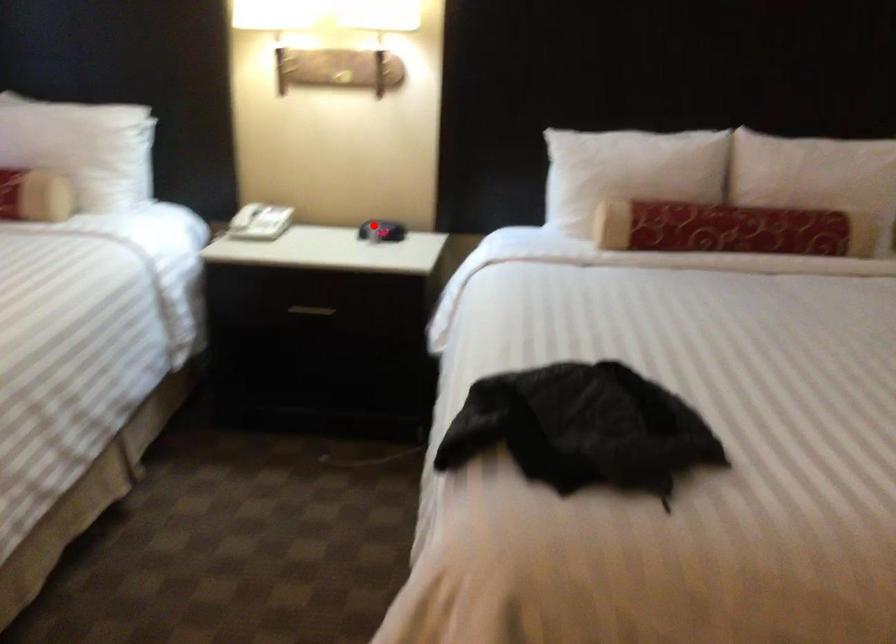
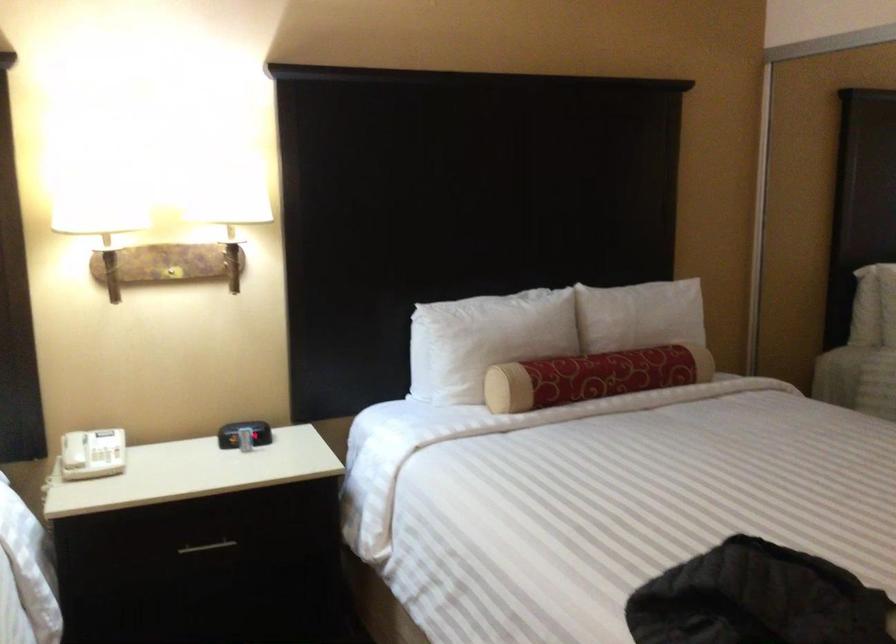
Question: I am providing you with two images of the same scene from different viewpoints. A red point is shown in image1. For the corresponding object point in image2, is it positioned nearer or farther from the camera?

Choices:
 (A) Nearer
 (B) Farther

Answer: (A)